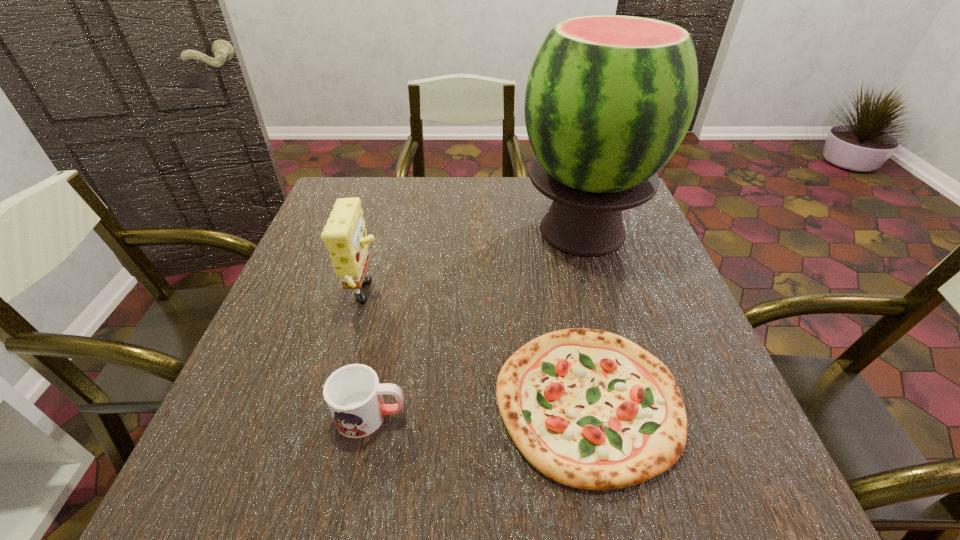
Locate an element on the screen. The height and width of the screenshot is (540, 960). free space between the tallest object and the mug is located at coordinates (477, 323).

This screenshot has width=960, height=540. In order to click on free space between the third tallest object and the shortest object in this screenshot , I will do `click(479, 408)`.

I want to click on free point between the tallest object and the sponge, so click(x=474, y=265).

Image resolution: width=960 pixels, height=540 pixels. Find the location of `vacant area that lies between the second shortest object and the shortest object`. vacant area that lies between the second shortest object and the shortest object is located at coordinates (479, 408).

Identify the location of free area in between the mug and the shortest object. (479, 408).

Locate an element on the screen. The image size is (960, 540). vacant region between the watermelon and the second tallest object is located at coordinates (474, 265).

I want to click on free space between the shortest object and the second shortest object, so click(x=479, y=408).

You are a GUI agent. You are given a task and a screenshot of the screen. Output one action in this format:
    pyautogui.click(x=<x>, y=<y>)
    Task: Click on the free space between the tallest object and the shortest object
    This screenshot has width=960, height=540.
    Given the screenshot: What is the action you would take?
    pyautogui.click(x=586, y=316)

Where is `free space between the shortest object and the tallest object`? The image size is (960, 540). free space between the shortest object and the tallest object is located at coordinates (586, 316).

Where is `vacant point located between the mug and the sponge`? The image size is (960, 540). vacant point located between the mug and the sponge is located at coordinates (368, 356).